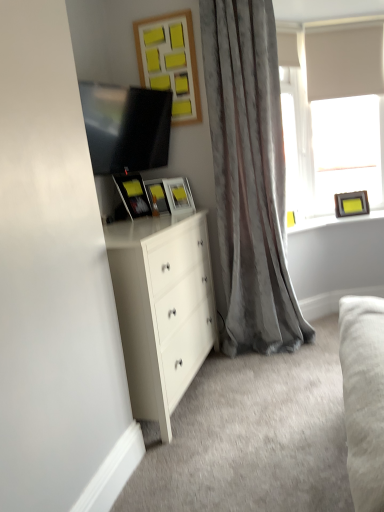
Question: Is matte black picture frame at upper right, the 1th picture frame from the right, taller or shorter than wooden yellow sticky notes at upper center, acting as the 3th picture frame starting from the right?

Choices:
 (A) tall
 (B) short

Answer: (B)

Question: Relative to wooden yellow sticky notes at upper center, which is counted as the third picture frame, starting from the left, is matte black picture frame at upper right, the 1th picture frame from the right, in front or behind?

Choices:
 (A) front
 (B) behind

Answer: (B)

Question: Which of these objects is positioned closest to the matte white picture frame at center, marked as the 2th picture frame in a left-to-right arrangement?

Choices:
 (A) matte black picture frame at upper right, positioned as the fifth picture frame in left-to-right order
 (B) matte yellow picture frame at upper center, which ranks as the second picture frame in right-to-left order
 (C) matte black picture frame at center, placed as the fifth picture frame when sorted from right to left
 (D) wooden yellow sticky notes at upper center, acting as the 3th picture frame starting from the right
 (E) white matte window at upper right

Answer: (B)

Question: Which is farther from the white matte window at upper right?

Choices:
 (A) matte black picture frame at center, which appears as the 1th picture frame when viewed from the left
 (B) matte black picture frame at upper right, positioned as the fifth picture frame in left-to-right order
 (C) satin gray curtain at center
 (D) yellow matte frame at upper right
 (E) matte black tv at upper left

Answer: (A)